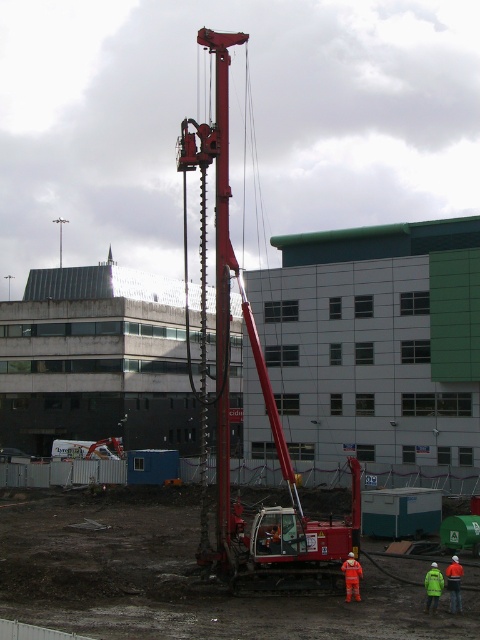
Where is `matte red crane at center`? matte red crane at center is located at coordinates (264, 406).

Is matte red crane at center wider than high visibility jacket at lower right?

Indeed, matte red crane at center has a greater width compared to high visibility jacket at lower right.

Is point (220, 538) in front of point (433, 593)?

No, it is not.

Where is `matte red crane at center`? The width and height of the screenshot is (480, 640). matte red crane at center is located at coordinates click(264, 406).

Is matte red crane at center positioned before teal matte container at center?

Yes, matte red crane at center is closer to the viewer.

Is matte red crane at center shorter than teal matte container at center?

In fact, matte red crane at center may be taller than teal matte container at center.

Identify the location of matte red crane at center. The width and height of the screenshot is (480, 640). (264, 406).

Can you confirm if orange reflective safety vest at lower right is shorter than orange reflective vest at lower right?

Incorrect, orange reflective safety vest at lower right's height does not fall short of orange reflective vest at lower right's.

In order to click on orange reflective safety vest at lower right in this screenshot , I will do `click(455, 584)`.

Where is `orange reflective safety vest at lower right`? The width and height of the screenshot is (480, 640). orange reflective safety vest at lower right is located at coordinates (455, 584).

Locate an element on the screen. This screenshot has height=640, width=480. orange reflective safety vest at lower right is located at coordinates (455, 584).